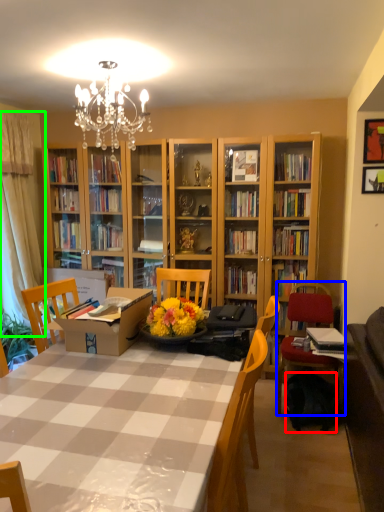
Question: Which object is positioned closest to backpack (highlighted by a red box)? Select from chair (highlighted by a blue box) and curtain (highlighted by a green box).

Choices:
 (A) chair
 (B) curtain

Answer: (A)